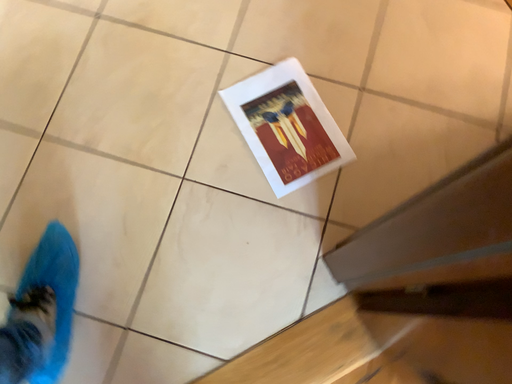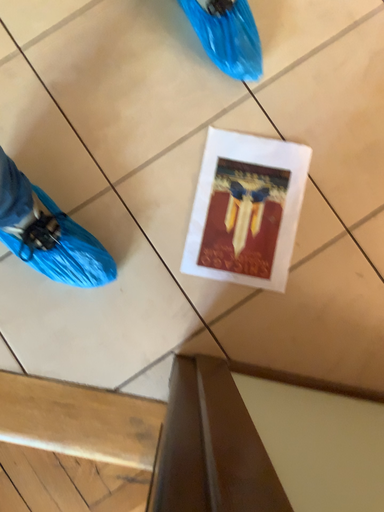
Question: Which way did the camera rotate in the video?

Choices:
 (A) rotated downward
 (B) rotated upward

Answer: (A)